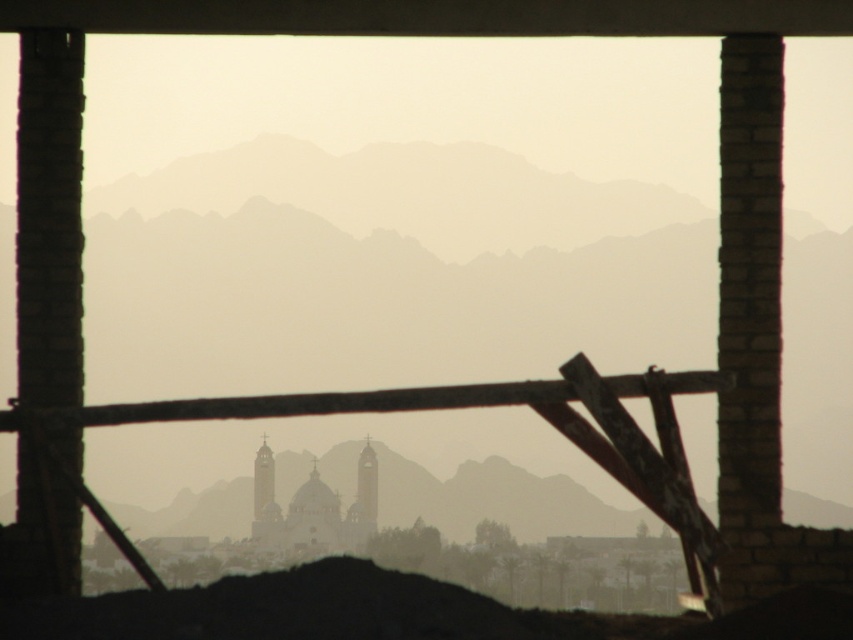
You are an architect reviewing a construction site. You notice the brick at right and the brown wooden beam at center. Which object is closer to you, the observer?

The brick at right is closer to you because the brown wooden beam at center is behind it.

You are an architect assessing the structural integrity of the unfinished building. You notice the brick at right and the brown wooden beam at center. Which object would you prioritize inspecting for potential stability issues, and why?

The brick at right has a larger size compared to the brown wooden beam at center, so it might have a greater weight and require more support. Therefore, the brick at right should be prioritized for inspection to ensure its stability.

You are an architect reviewing the construction site. You notice the brick wall at left and the brown wooden beam at center. Which object is located below the other?

The brick wall at left is positioned under the brown wooden beam at center, meaning the brick wall is below the beam.